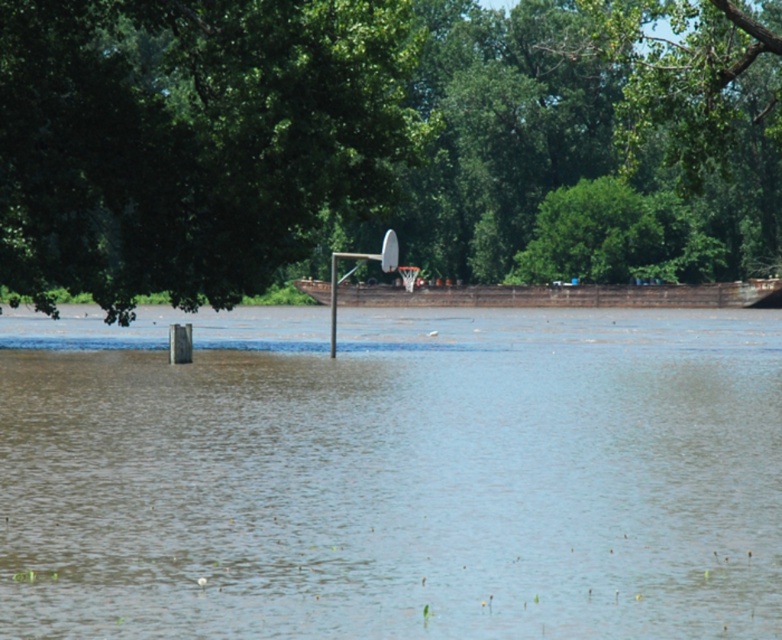
Between green leafy tree at upper left and green leafy tree at upper center, which one appears on the left side from the viewer's perspective?

Positioned to the left is green leafy tree at upper left.

Can you confirm if green leafy tree at upper left is taller than green leafy tree at upper center?

In fact, green leafy tree at upper left may be shorter than green leafy tree at upper center.

The image size is (782, 640). I want to click on green leafy tree at upper left, so click(x=192, y=140).

Which is in front, point (698, 364) or point (339, 118)?

Positioned in front is point (339, 118).

The height and width of the screenshot is (640, 782). What are the coordinates of `brown muddy water at center` in the screenshot? It's located at (393, 476).

Is point (210, 499) positioned before point (235, 248)?

Yes.

Where is `brown muddy water at center`? This screenshot has width=782, height=640. brown muddy water at center is located at coordinates (393, 476).

Between green leafy tree at upper left and metallic silver basketball hoop at center, which one has more height?

With more height is green leafy tree at upper left.

Who is positioned more to the right, green leafy tree at upper left or metallic silver basketball hoop at center?

Positioned to the right is metallic silver basketball hoop at center.

Is point (228, 173) in front of point (329, 353)?

That is True.

Locate an element on the screen. green leafy tree at upper left is located at coordinates (192, 140).